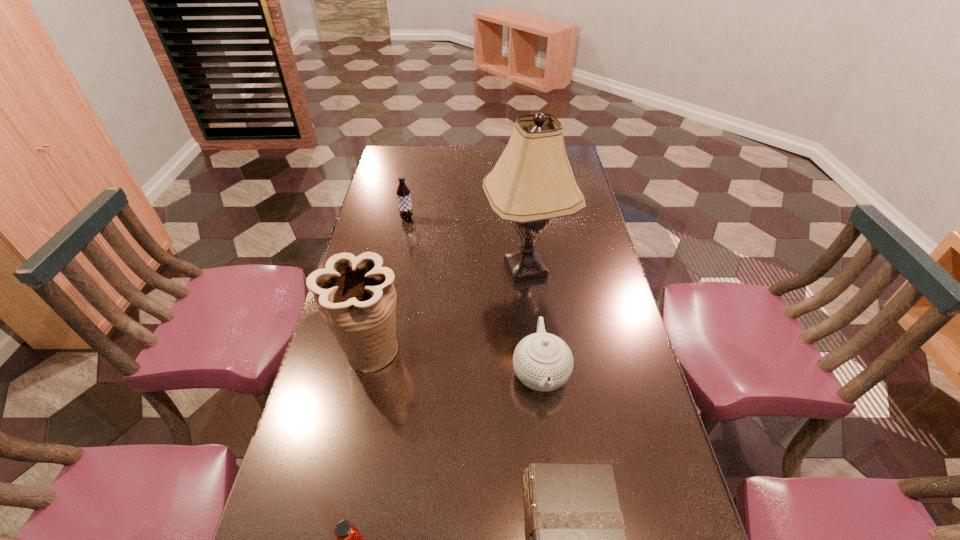
Where is `free space between the urn and the third shortest object`? This screenshot has height=540, width=960. free space between the urn and the third shortest object is located at coordinates (455, 361).

Identify the location of vacant area that lies between the fifth nearest object and the root beer. This screenshot has width=960, height=540. (467, 244).

You are a GUI agent. You are given a task and a screenshot of the screen. Output one action in this format:
    pyautogui.click(x=<x>, y=<y>)
    Task: Click on the fourth closest object to the lamp
    
    Given the screenshot: What is the action you would take?
    click(576, 531)

This screenshot has height=540, width=960. Find the location of `object that is the fifth nearest to the root beer`. object that is the fifth nearest to the root beer is located at coordinates (349, 539).